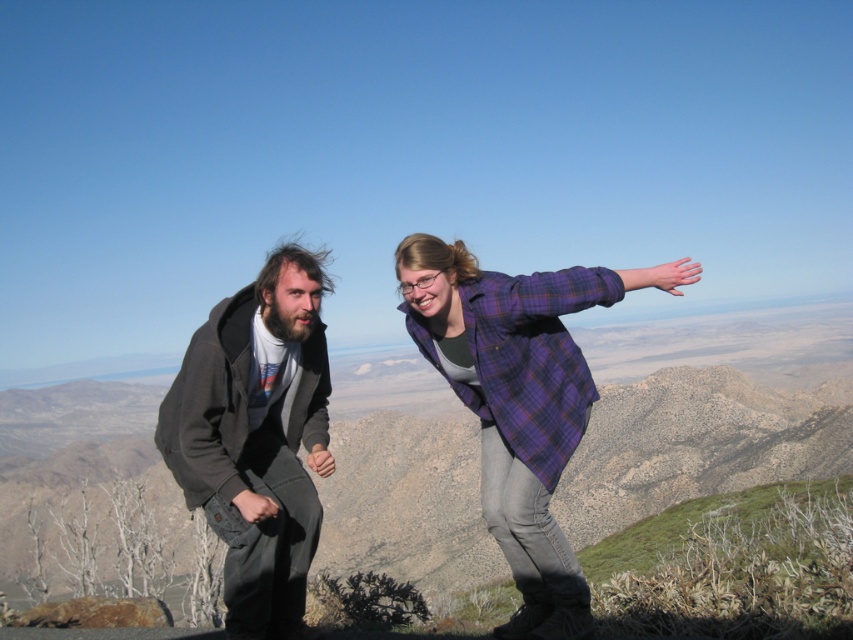
Question: Is purple flannel shirt at center bigger than dark gray hoodie at left?

Choices:
 (A) yes
 (B) no

Answer: (A)

Question: Which object appears closest to the camera in this image?

Choices:
 (A) dark gray hoodie at left
 (B) purple flannel shirt at center

Answer: (B)

Question: Can you confirm if purple flannel shirt at center is positioned to the right of dark gray hoodie at left?

Choices:
 (A) no
 (B) yes

Answer: (B)

Question: Is purple flannel shirt at center positioned in front of dark gray hoodie at left?

Choices:
 (A) no
 (B) yes

Answer: (B)

Question: Which point is farther to the camera?

Choices:
 (A) (575, 276)
 (B) (193, 497)

Answer: (A)